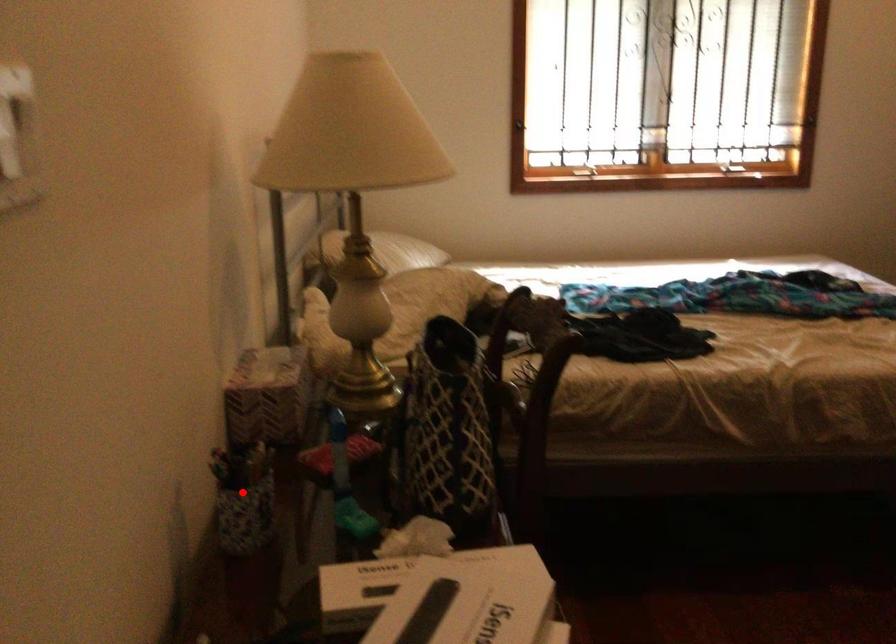
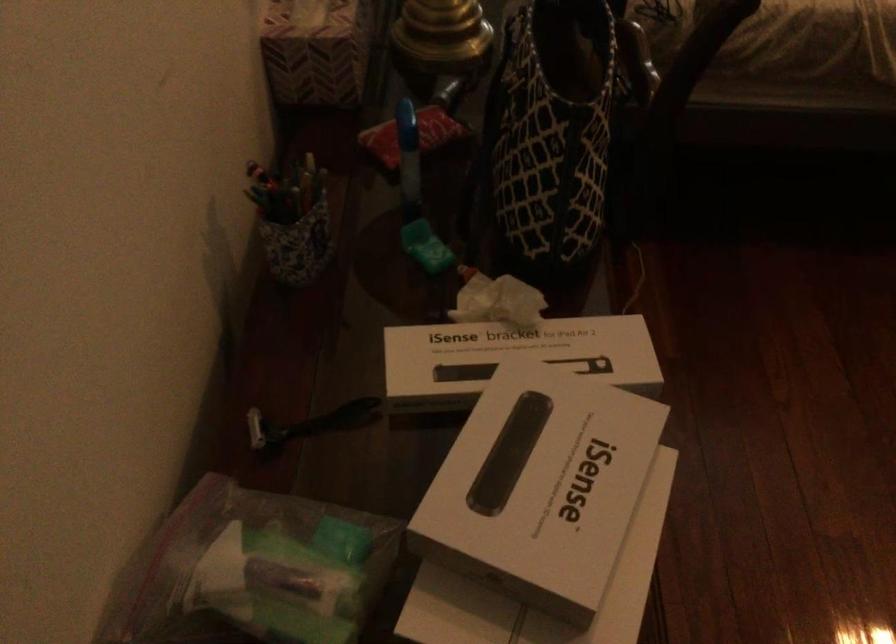
Question: I am providing you with two images of the same scene from different viewpoints. A red point is shown in image1. For the corresponding object point in image2, is it positioned nearer or farther from the camera?

Choices:
 (A) Nearer
 (B) Farther

Answer: (A)